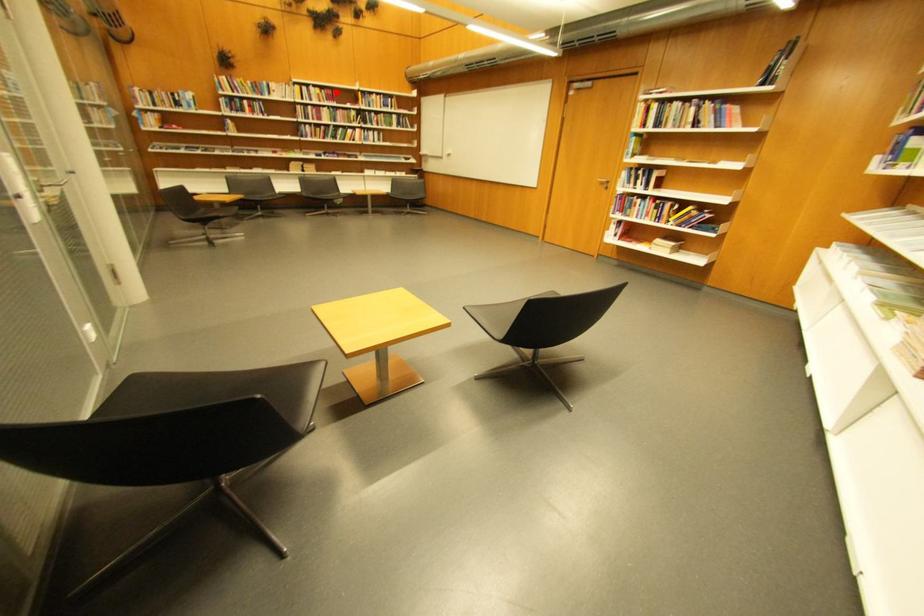
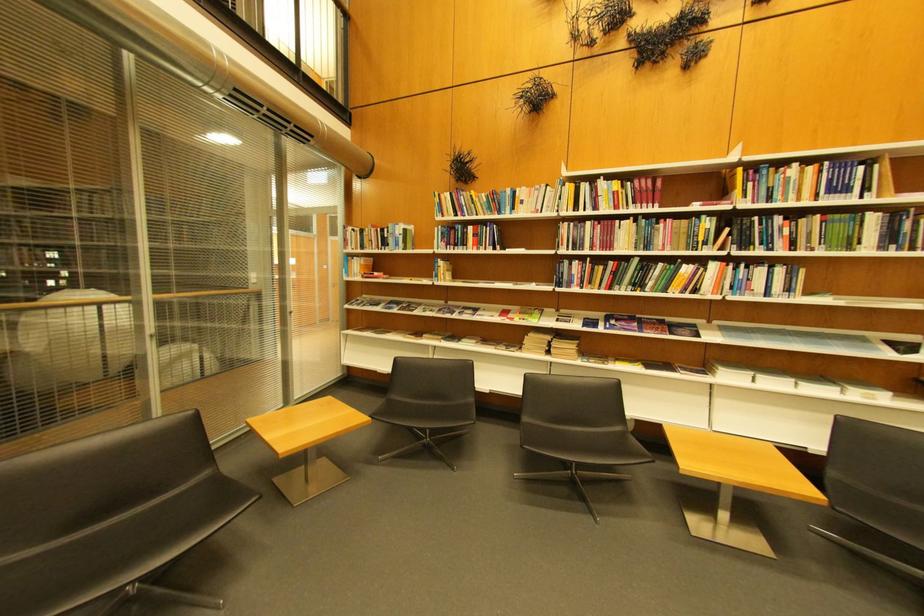
Where in the second image is the point corresponding to the highlighted location from the first image?

(648, 183)